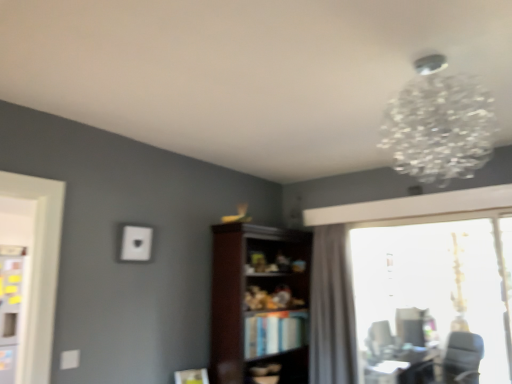
Question: Based on their sizes in the image, would you say gray fabric curtain at right is bigger or smaller than dark wood bookshelf at center?

Choices:
 (A) small
 (B) big

Answer: (A)

Question: Based on their positions, is gray fabric curtain at right located to the left or right of dark wood bookshelf at center?

Choices:
 (A) left
 (B) right

Answer: (B)

Question: Which object is positioned farthest from the dark wood bookshelf at center?

Choices:
 (A) matte black swivel chair at lower right, the second swivel chair in the right-to-left sequence
 (B) clear crystal chandelier at upper right
 (C) gray fabric curtain at right
 (D) transparent glass window at right
 (E) black leather swivel chair at lower right, which ranks as the second swivel chair in left-to-right order

Answer: (E)

Question: Estimate the real-world distances between objects in this image. Which object is closer to the hardcover book at center?

Choices:
 (A) black leather swivel chair at lower right, the 1th swivel chair when ordered from right to left
 (B) clear crystal chandelier at upper right
 (C) gray fabric curtain at right
 (D) matte black swivel chair at lower right, the first swivel chair from the left
 (E) dark wood bookshelf at center

Answer: (E)